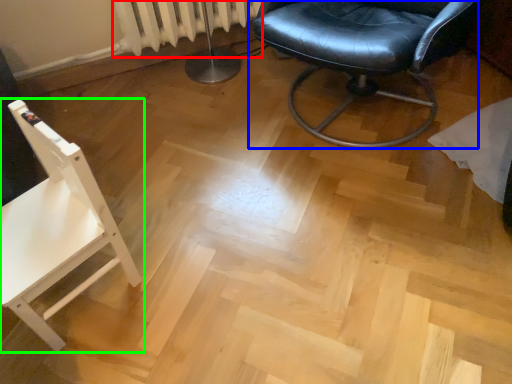
Question: Which is farther away from radiator (highlighted by a red box)? chair (highlighted by a blue box) or chair (highlighted by a green box)?

Choices:
 (A) chair
 (B) chair

Answer: (B)